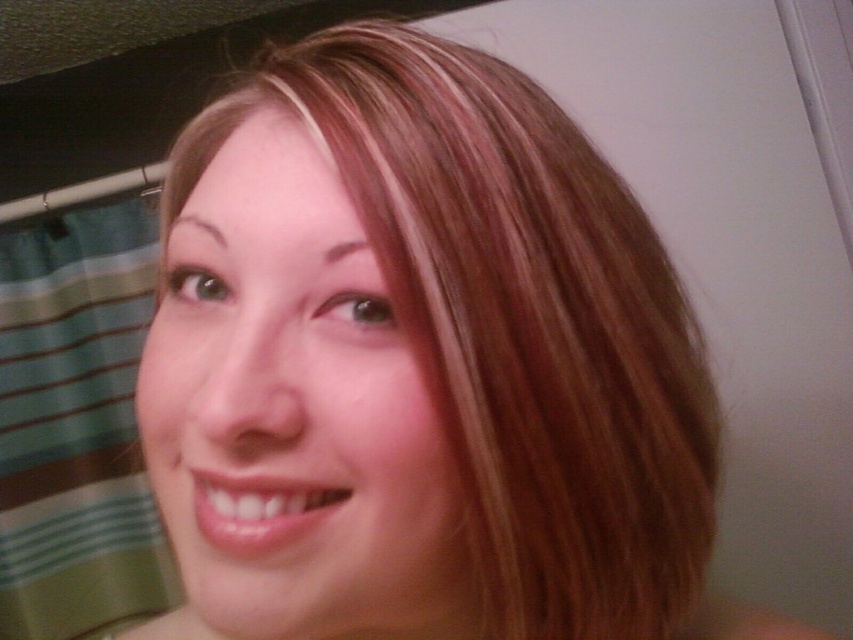
Between point (456, 205) and point (341, 404), which one is positioned in front?

Point (341, 404)

Which is above, blonde hair at center or smooth skin face at center?

blonde hair at center is above.

Is point (440, 225) positioned behind point (293, 282)?

No.

Find the location of `blonde hair at center`. blonde hair at center is located at coordinates pyautogui.click(x=428, y=368).

Between smooth skin face at center and green striped fabric at left, which one has more height?

green striped fabric at left

Who is more forward, (456, 572) or (166, 561)?

Point (456, 572) is more forward.

At what (x,y) coordinates should I click in order to perform the action: click on smooth skin face at center. Please return your answer as a coordinate pair (x, y). Looking at the image, I should click on 293,416.

Between blonde hair at center and green striped fabric at left, which one has less height?

blonde hair at center is shorter.

Image resolution: width=853 pixels, height=640 pixels. Identify the location of blonde hair at center. (428, 368).

This screenshot has width=853, height=640. What are the coordinates of `blonde hair at center` in the screenshot? It's located at (428, 368).